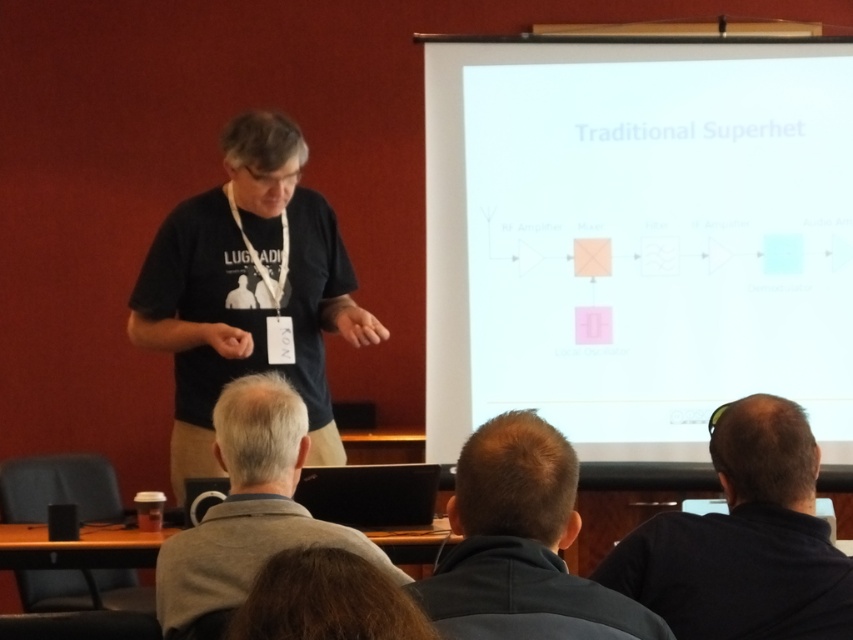
Question: Among these points, which one is nearest to the camera?

Choices:
 (A) (184, 560)
 (B) (495, 433)

Answer: (B)

Question: From the image, what is the correct spatial relationship of black matte shirt at lower right in relation to dark brown hair at lower center?

Choices:
 (A) below
 (B) above

Answer: (A)

Question: Is black matte shirt at lower right closer to camera compared to gray woolen sweater at lower left?

Choices:
 (A) yes
 (B) no

Answer: (A)

Question: Can you confirm if black matte shirt at lower right is positioned to the right of dark brown hair at lower center?

Choices:
 (A) yes
 (B) no

Answer: (A)

Question: Which of the following is the closest to the observer?

Choices:
 (A) gray woolen sweater at lower left
 (B) black matte shirt at lower right
 (C) white paper at upper center
 (D) dark brown hair at lower center

Answer: (D)

Question: Which point appears closest to the camera in this image?

Choices:
 (A) (724, 52)
 (B) (349, 285)

Answer: (B)